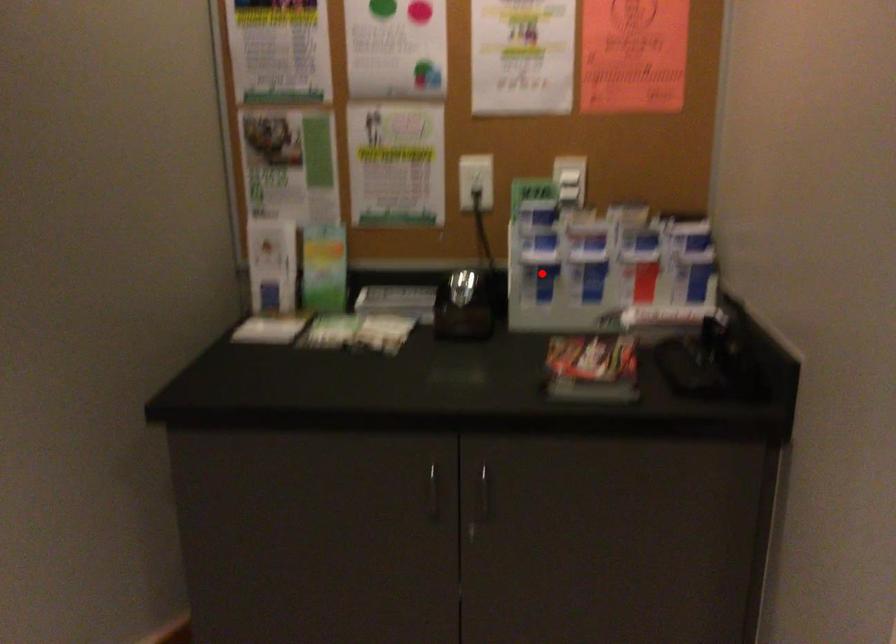
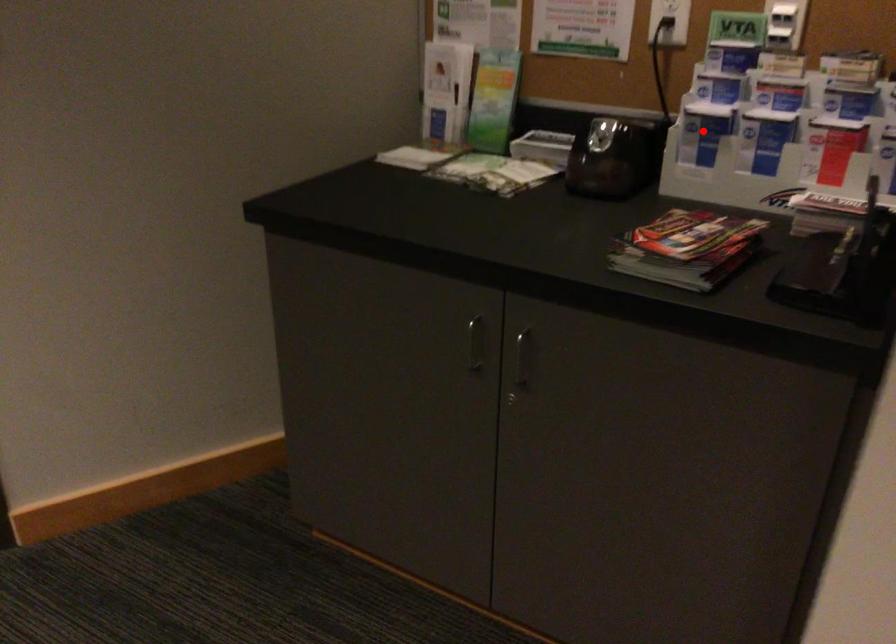
Looking at this image, I am providing you with two images of the same scene from different viewpoints. A red point is marked on the first image and another point is marked on the second image. Are the points marked in image1 and image2 representing the same 3D position?

Yes